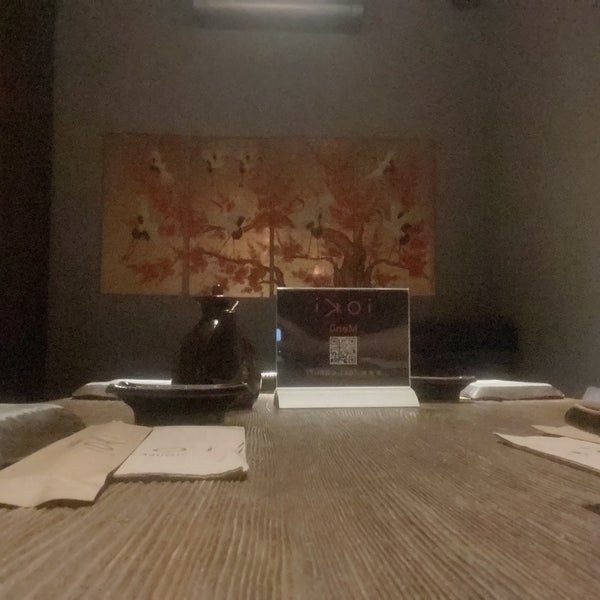
At what (x,y) coordinates should I click in order to perform the action: click on empty space in table. Please return your answer as a coordinate pair (x, y). The image size is (600, 600). Looking at the image, I should click on (358, 522).